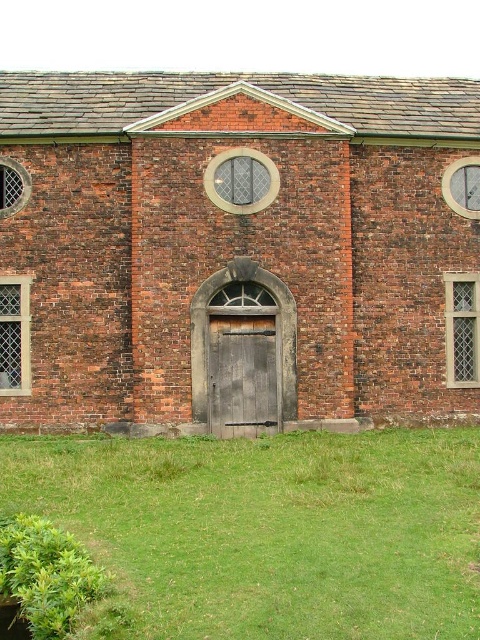
You are standing in front of the brick building and want to determine the relative positions of two points marked on the facade. Which point is closer to you, point 1 at coordinates (468, 564) or point 2 at coordinates (257, 403)?

Point 1 at coordinates (468, 564) is closer to you than point 2 at coordinates (257, 403).

In the scene shown: You are standing in front of the brick building and see a point marked at coordinates [271,529]. Based on the scene description, what is the location of this point relative to the building?

The point is on green grass at lower center, which is in front of the brick building.